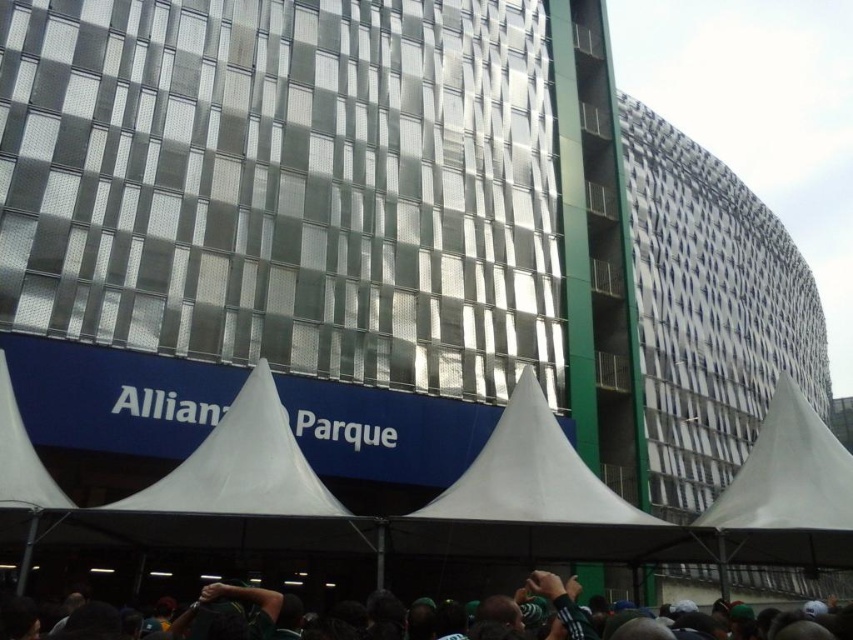
You are attending an event at Allianz Parque and need to find a shaded area. You see the dark green fabric at lower center and the white fabric canopy at lower left. Which one is closer to the right side of the building?

The dark green fabric at lower center is positioned on the right side of the white fabric canopy at lower left, so it is closer to the right side of the building.

Based on the photo, you are attending an event at Allianz Parque and need to find a shaded area. You see the dark green fabric at lower center and the white fabric canopy at lower left. Which one provides more vertical space for standing under it?

The dark green fabric at lower center has a greater height compared to the white fabric canopy at lower left, so it provides more vertical space for standing under it.